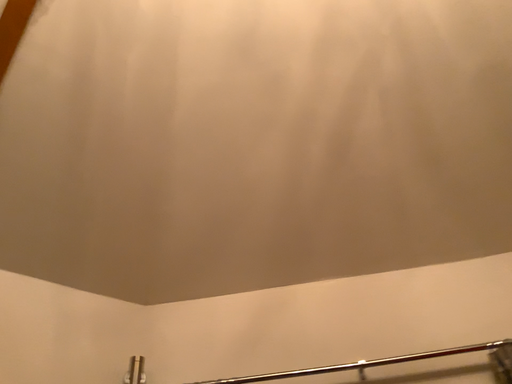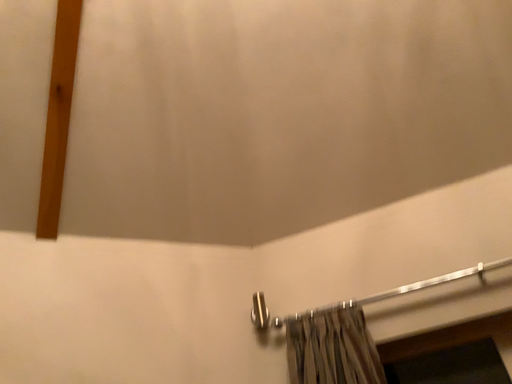
Question: Which way did the camera rotate in the video?

Choices:
 (A) rotated right
 (B) rotated left

Answer: (B)